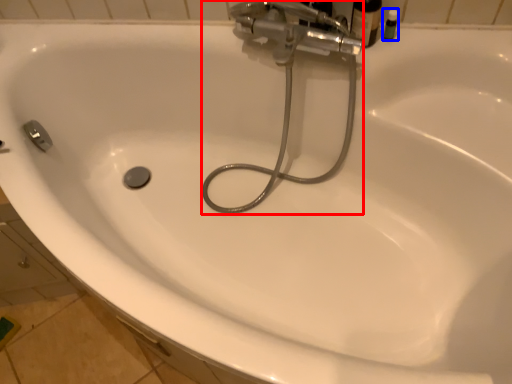
Question: Which object appears farthest to the camera in this image, plumbing fixture (highlighted by a red box) or toiletry (highlighted by a blue box)?

Choices:
 (A) plumbing fixture
 (B) toiletry

Answer: (B)